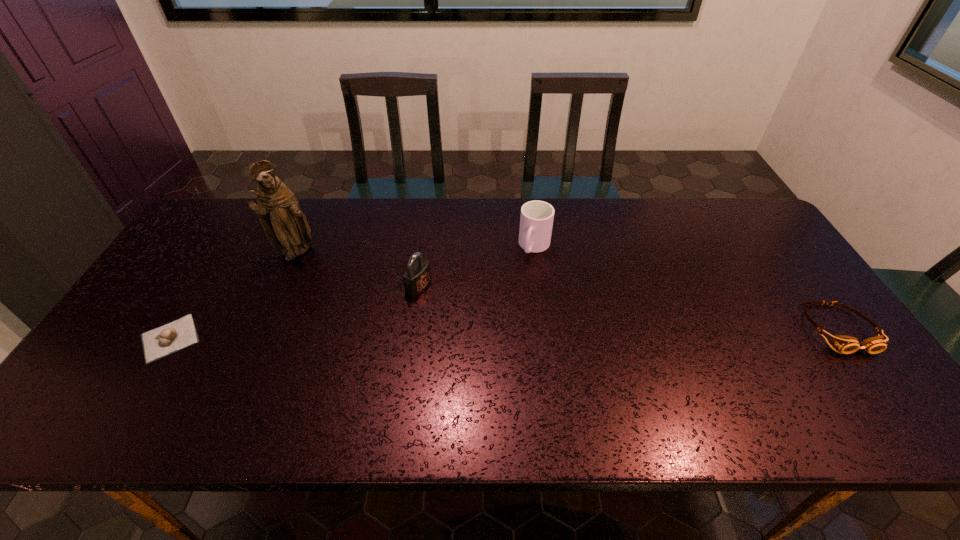
The image size is (960, 540). In order to click on unoccupied position between the goggles and the figurine in this screenshot , I will do `click(567, 291)`.

Locate which object ranks in proximity to the third object from right to left. Please provide its 2D coordinates. Your answer should be formatted as a tuple, i.e. [(x, y)], where the tuple contains the x and y coordinates of a point satisfying the conditions above.

[(536, 221)]

Select which object appears as the fourth closest to the cup. Please provide its 2D coordinates. Your answer should be formatted as a tuple, i.e. [(x, y)], where the tuple contains the x and y coordinates of a point satisfying the conditions above.

[(157, 343)]

Locate an element on the screen. vacant area in the image that satisfies the following two spatial constraints: 1. on the front side of the figurine; 2. on the right side of the third object from left to right is located at coordinates (282, 286).

Locate an element on the screen. This screenshot has height=540, width=960. vacant space that satisfies the following two spatial constraints: 1. on the back side of the garlic; 2. on the left side of the padlock is located at coordinates (203, 286).